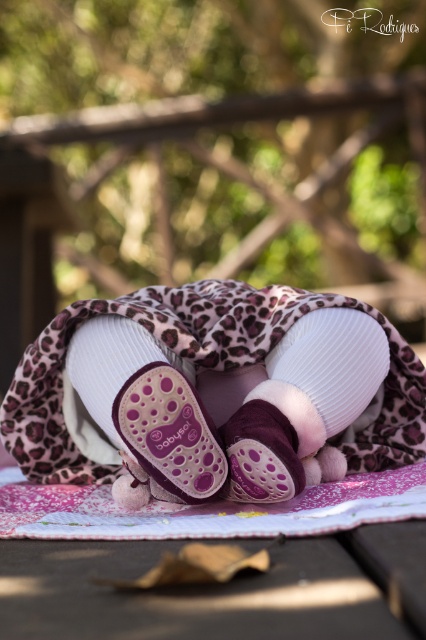
Question: Does leopard print fabric at center appear on the left side of purple suede baby bootie at center?

Choices:
 (A) yes
 (B) no

Answer: (B)

Question: From the image, what is the correct spatial relationship of purple suede baby bootie at center in relation to purple suede booties at center?

Choices:
 (A) right
 (B) left

Answer: (B)

Question: Is purple suede baby bootie at center wider than purple suede booties at center?

Choices:
 (A) yes
 (B) no

Answer: (A)

Question: Which point is closer to the camera taking this photo?

Choices:
 (A) (388, 436)
 (B) (158, 362)
 (C) (342, 312)

Answer: (B)

Question: Which point appears closest to the camera in this image?

Choices:
 (A) (296, 301)
 (B) (241, 486)

Answer: (B)

Question: Based on their relative distances, which object is nearer to the purple suede baby bootie at center?

Choices:
 (A) leopard print fabric at center
 (B) purple suede booties at center

Answer: (B)